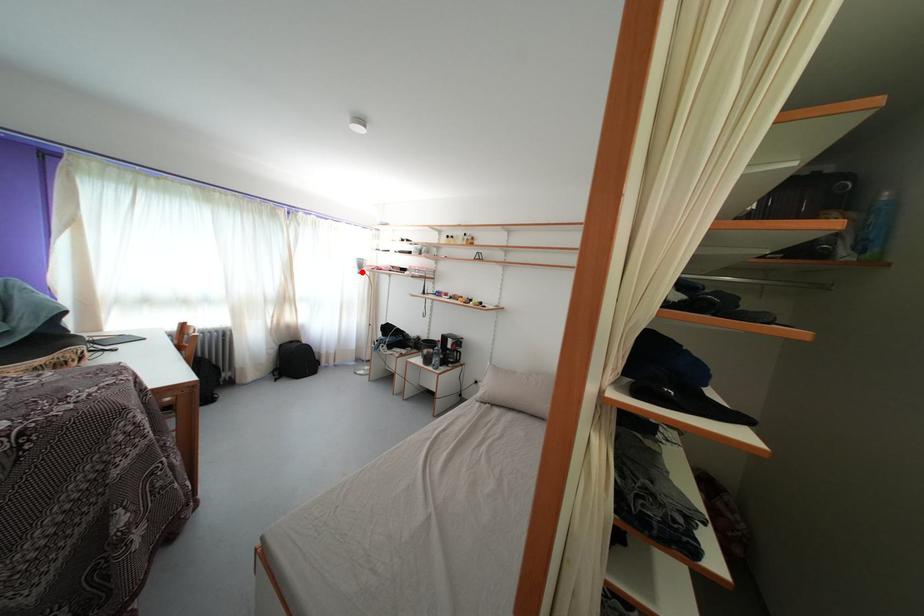
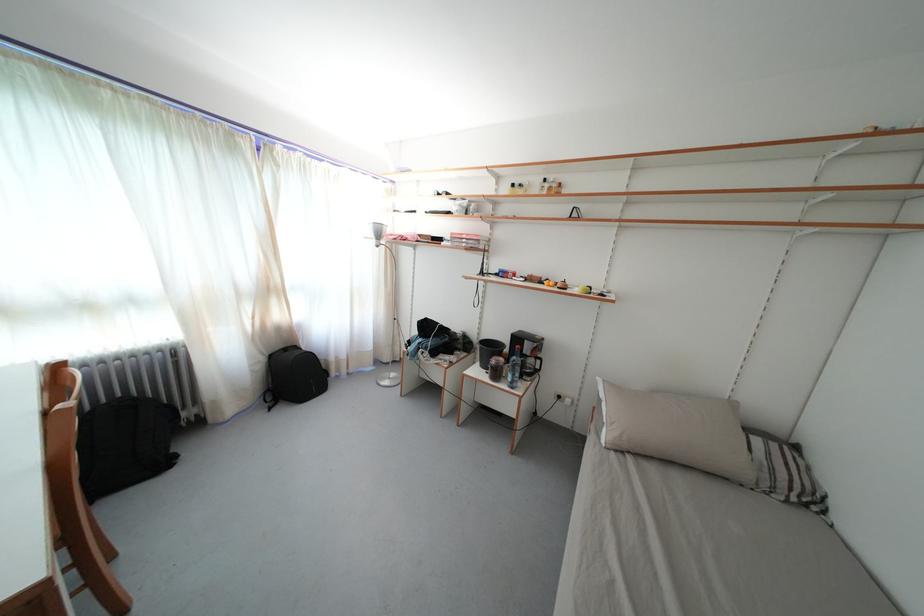
Question: I am providing you with two images of the same scene from different viewpoints. A red point is marked on the first image. At the location where the point appears in image 1, is it still visible in image 2?

Choices:
 (A) Yes
 (B) No

Answer: (A)